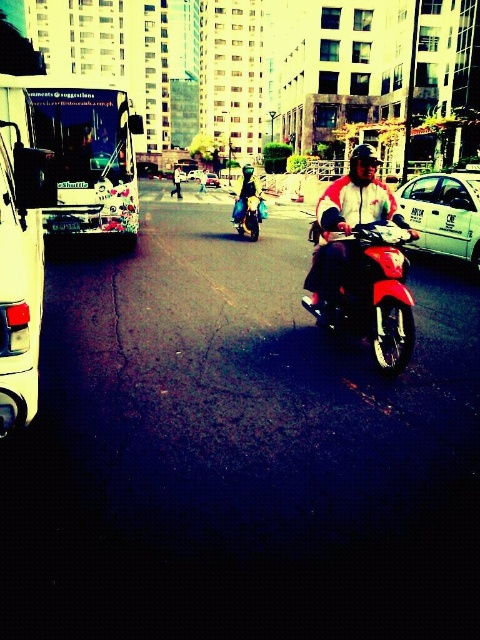
You are a pedestrian standing at the crosswalk and need to decide which vehicle to cross in front of first. The white matte taxi at center and the metallic silver car at center are both approaching. Based on their positions, which vehicle should you cross in front of first?

The white matte taxi at center is closer to the viewer than the metallic silver car at center, so you should cross in front of the white matte taxi at center first before the metallic silver car at center arrives.

What does the point at coordinates (x=347, y=228) represent in the image?

The point at coordinates (x=347, y=228) represents the red matte motorcycle at center.

You are standing at the center of the image. Which object is located at the coordinates point (x=21, y=276)?

The white matte van at left is located at point (x=21, y=276).